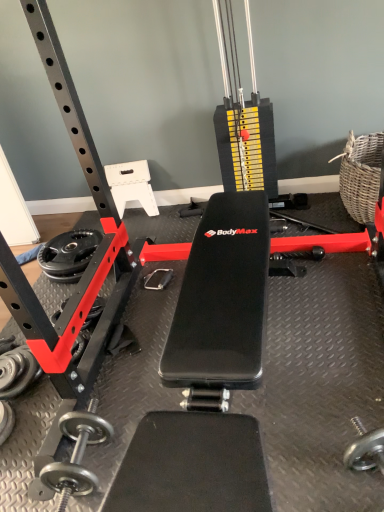
The height and width of the screenshot is (512, 384). In order to click on vacant area to the right of silver metallic dumbbell at lower left, the second dumbbell in the top-to-bottom sequence in this screenshot , I will do [x=32, y=425].